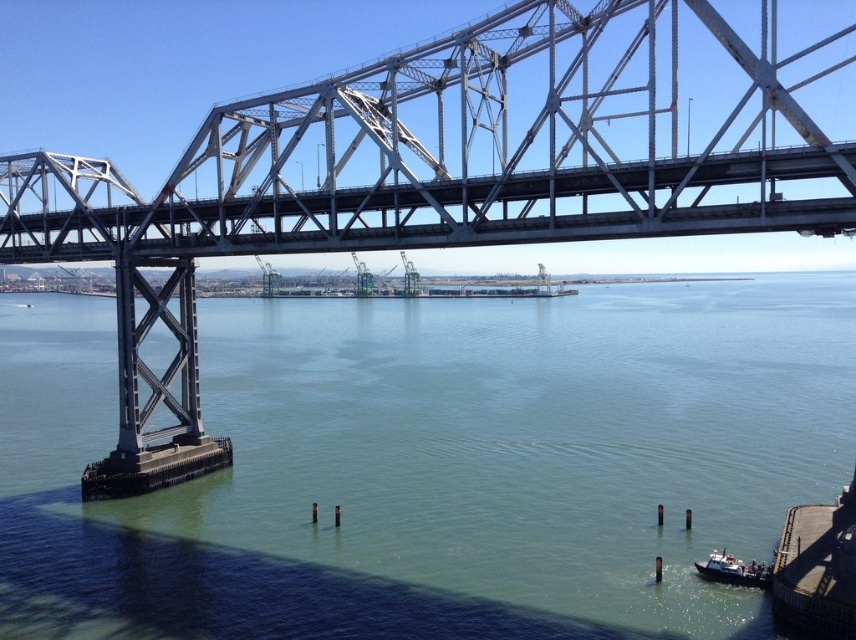
Is smooth concrete dock at lower right to the right of white plastic boat at lower right from the viewer's perspective?

Yes, smooth concrete dock at lower right is to the right of white plastic boat at lower right.

Which is more to the left, smooth concrete dock at lower right or white plastic boat at lower right?

white plastic boat at lower right is more to the left.

Is point (825, 588) more distant than point (732, 564)?

No, it is in front of (732, 564).

Where is `smooth concrete dock at lower right`? smooth concrete dock at lower right is located at coordinates (817, 570).

At what (x,y) coordinates should I click in order to perform the action: click on green water at lower center. Please return your answer as a coordinate pair (x, y). The height and width of the screenshot is (640, 856). Looking at the image, I should click on (432, 465).

Is point (401, 499) positioned behind point (854, 531)?

Yes, it is behind point (854, 531).

Who is more distant from viewer, (x=169, y=502) or (x=789, y=524)?

Point (x=169, y=502)

Find the location of a particular element. This screenshot has height=640, width=856. green water at lower center is located at coordinates 432,465.

Consider the image. Which of these two, green water at lower center or white plastic boat at lower right, stands taller?

Standing taller between the two is green water at lower center.

Is point (369, 516) farther from camera compared to point (696, 564)?

Yes, point (369, 516) is behind point (696, 564).

At what (x,y) coordinates should I click in order to perform the action: click on green water at lower center. Please return your answer as a coordinate pair (x, y). The image size is (856, 640). Looking at the image, I should click on (432, 465).